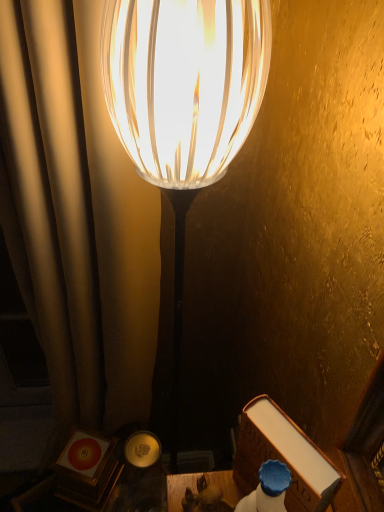
Question: Does translucent glass lamp at center lie in front of wooden table at lower center?

Choices:
 (A) no
 (B) yes

Answer: (B)

Question: Is wooden table at lower center a part of translucent glass lamp at center?

Choices:
 (A) no
 (B) yes

Answer: (A)

Question: Can you confirm if translucent glass lamp at center is wider than wooden table at lower center?

Choices:
 (A) no
 (B) yes

Answer: (B)

Question: Is translucent glass lamp at center directly adjacent to wooden table at lower center?

Choices:
 (A) yes
 (B) no

Answer: (B)

Question: Is translucent glass lamp at center taller than wooden table at lower center?

Choices:
 (A) no
 (B) yes

Answer: (B)

Question: Considering the relative sizes of translucent glass lamp at center and wooden table at lower center in the image provided, is translucent glass lamp at center bigger than wooden table at lower center?

Choices:
 (A) yes
 (B) no

Answer: (A)

Question: Does translucent glass lamp at center lie behind brown leather book at lower right?

Choices:
 (A) no
 (B) yes

Answer: (A)

Question: Considering the relative sizes of translucent glass lamp at center and brown leather book at lower right in the image provided, is translucent glass lamp at center shorter than brown leather book at lower right?

Choices:
 (A) yes
 (B) no

Answer: (B)

Question: Is translucent glass lamp at center thinner than brown leather book at lower right?

Choices:
 (A) no
 (B) yes

Answer: (A)

Question: From the image's perspective, does translucent glass lamp at center appear higher than brown leather book at lower right?

Choices:
 (A) yes
 (B) no

Answer: (A)

Question: Can you confirm if translucent glass lamp at center is bigger than brown leather book at lower right?

Choices:
 (A) no
 (B) yes

Answer: (B)

Question: From a real-world perspective, is translucent glass lamp at center on brown leather book at lower right?

Choices:
 (A) yes
 (B) no

Answer: (B)

Question: Is wooden table at lower center closer to camera compared to translucent glass lamp at center?

Choices:
 (A) no
 (B) yes

Answer: (A)